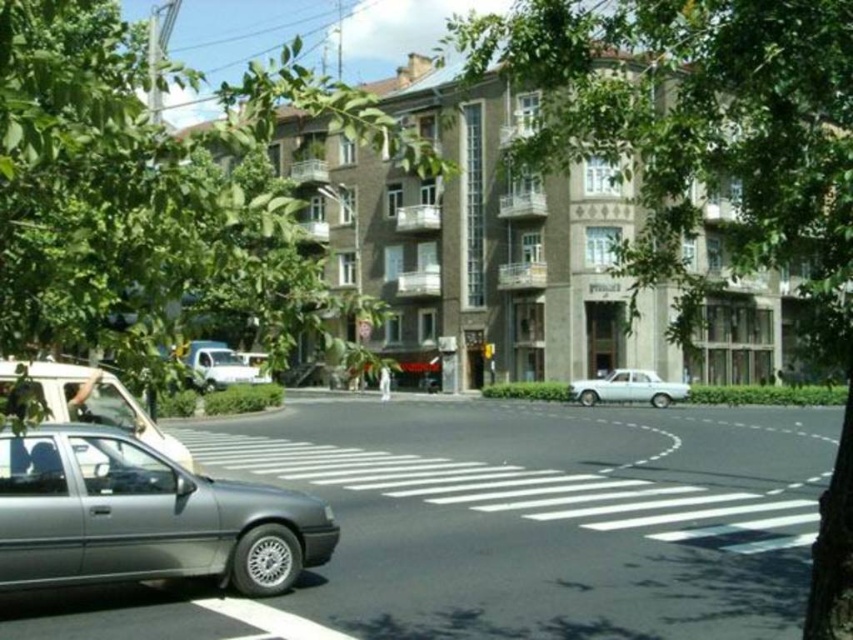
Does silver metallic car at left have a lesser height compared to white glossy car at lower right?

Indeed, silver metallic car at left has a lesser height compared to white glossy car at lower right.

Which is above, silver metallic car at left or white glossy car at lower right?

silver metallic car at left is above.

Does point (173, 451) come in front of point (646, 388)?

Yes, point (173, 451) is in front of point (646, 388).

Identify the location of silver metallic car at left. (90, 401).

Is green leafy tree at center closer to the viewer compared to metallic gray sedan at lower left?

Yes, it is.

Is green leafy tree at center positioned at the back of metallic gray sedan at lower left?

No, it is not.

I want to click on green leafy tree at center, so click(x=709, y=164).

How far apart are green leafy tree at upper left and white glossy car at lower right?

green leafy tree at upper left and white glossy car at lower right are 62.17 feet apart from each other.

Which of these two, green leafy tree at upper left or white glossy car at lower right, stands shorter?

white glossy car at lower right is shorter.

Does point (26, 35) lie in front of point (590, 384)?

That is True.

The height and width of the screenshot is (640, 853). I want to click on green leafy tree at upper left, so click(x=154, y=195).